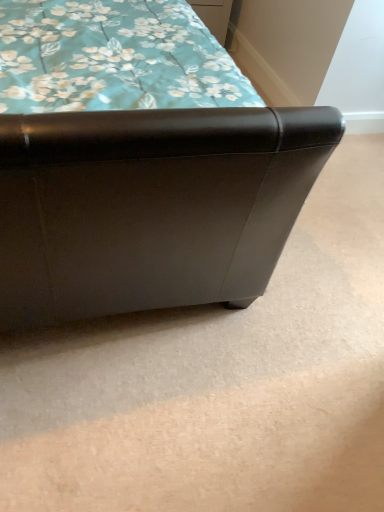
Locate an element on the screen. matte black ottoman at lower left is located at coordinates (150, 206).

What is the approximate width of matte black ottoman at lower left?

matte black ottoman at lower left is 1.19 meters wide.

Measure the distance between point (95,38) and camera.

Point (95,38) is 1.07 meters from camera.

The width and height of the screenshot is (384, 512). Describe the element at coordinates (150, 206) in the screenshot. I see `matte black ottoman at lower left` at that location.

The height and width of the screenshot is (512, 384). In order to click on matte wood drawer at upper center in this screenshot , I will do `click(214, 15)`.

What is the approximate width of matte wood drawer at upper center?

matte wood drawer at upper center is 34.55 centimeters in width.

Image resolution: width=384 pixels, height=512 pixels. Describe the element at coordinates (214, 15) in the screenshot. I see `matte wood drawer at upper center` at that location.

Based on the photo, what is the approximate height of matte wood drawer at upper center?

matte wood drawer at upper center is 11.28 inches in height.

At what (x,y) coordinates should I click in order to perform the action: click on matte black ottoman at lower left. Please return your answer as a coordinate pair (x, y). The image size is (384, 512). Looking at the image, I should click on (150, 206).

Which object is positioned more to the left, matte black ottoman at lower left or matte wood drawer at upper center?

matte black ottoman at lower left is more to the left.

Considering the positions of objects matte black ottoman at lower left and matte wood drawer at upper center in the image provided, who is in front, matte black ottoman at lower left or matte wood drawer at upper center?

matte black ottoman at lower left.

Is point (298, 123) closer or farther from the camera than point (207, 7)?

Point (298, 123).

From the image's perspective, is matte black ottoman at lower left over matte wood drawer at upper center?

Actually, matte black ottoman at lower left appears below matte wood drawer at upper center in the image.

From a real-world perspective, who is located lower, matte black ottoman at lower left or matte wood drawer at upper center?

In real-world perspective, matte wood drawer at upper center is lower.

Which of these two, matte black ottoman at lower left or matte wood drawer at upper center, is thinner?

With smaller width is matte wood drawer at upper center.

Between matte black ottoman at lower left and matte wood drawer at upper center, which one has more height?

matte black ottoman at lower left is taller.

Based on their sizes in the image, would you say matte black ottoman at lower left is bigger or smaller than matte wood drawer at upper center?

In the image, matte black ottoman at lower left appears to be larger than matte wood drawer at upper center.

Do you think matte black ottoman at lower left is within matte wood drawer at upper center, or outside of it?

The correct answer is: outside.

Can you see matte black ottoman at lower left touching matte wood drawer at upper center?

matte black ottoman at lower left and matte wood drawer at upper center are not in contact.

Is matte black ottoman at lower left positioned with its back to matte wood drawer at upper center?

No, matte black ottoman at lower left's orientation is not away from matte wood drawer at upper center.

What's the angular difference between matte black ottoman at lower left and matte wood drawer at upper center's facing directions?

0.907 degrees.

Identify the location of drawer behind the matte black ottoman at lower left. Image resolution: width=384 pixels, height=512 pixels. (214, 15).

Considering the positions of objects matte wood drawer at upper center and matte black ottoman at lower left in the image provided, who is more to the right, matte wood drawer at upper center or matte black ottoman at lower left?

From the viewer's perspective, matte wood drawer at upper center appears more on the right side.

Is the position of matte wood drawer at upper center less distant than that of matte black ottoman at lower left?

No.

Considering the positions of point (208, 1) and point (310, 163), is point (208, 1) closer or farther from the camera than point (310, 163)?

Point (208, 1) appears to be farther away from the viewer than point (310, 163).

From the image's perspective, is matte wood drawer at upper center on top of matte black ottoman at lower left?

Yes, from the image's perspective, matte wood drawer at upper center is on top of matte black ottoman at lower left.

From a real-world perspective, between matte wood drawer at upper center and matte black ottoman at lower left, who is vertically higher?

From a 3D spatial view, matte black ottoman at lower left is above.

Considering the sizes of objects matte wood drawer at upper center and matte black ottoman at lower left in the image provided, who is thinner, matte wood drawer at upper center or matte black ottoman at lower left?

matte wood drawer at upper center.

Between matte wood drawer at upper center and matte black ottoman at lower left, which one has more height?

With more height is matte black ottoman at lower left.

Does matte wood drawer at upper center have a smaller size compared to matte black ottoman at lower left?

Yes, matte wood drawer at upper center is smaller than matte black ottoman at lower left.

Is matte wood drawer at upper center spatially inside matte black ottoman at lower left, or outside of it?

matte wood drawer at upper center exists outside the volume of matte black ottoman at lower left.

Are matte wood drawer at upper center and matte black ottoman at lower left far apart?

Yes, matte wood drawer at upper center and matte black ottoman at lower left are quite far apart.

Is matte wood drawer at upper center oriented towards matte black ottoman at lower left?

No, matte wood drawer at upper center is not oriented towards matte black ottoman at lower left.

Measure the distance between matte wood drawer at upper center and matte black ottoman at lower left.

The distance of matte wood drawer at upper center from matte black ottoman at lower left is 1.91 meters.

The width and height of the screenshot is (384, 512). In order to click on drawer that appears below the matte black ottoman at lower left (from a real-world perspective) in this screenshot , I will do `click(214, 15)`.

Identify the location of furniture on the left of matte wood drawer at upper center. (150, 206).

You are a GUI agent. You are given a task and a screenshot of the screen. Output one action in this format:
    pyautogui.click(x=<x>, y=<y>)
    Task: Click on the furniture lying in front of the matte wood drawer at upper center
    This screenshot has width=384, height=512.
    Given the screenshot: What is the action you would take?
    pyautogui.click(x=150, y=206)